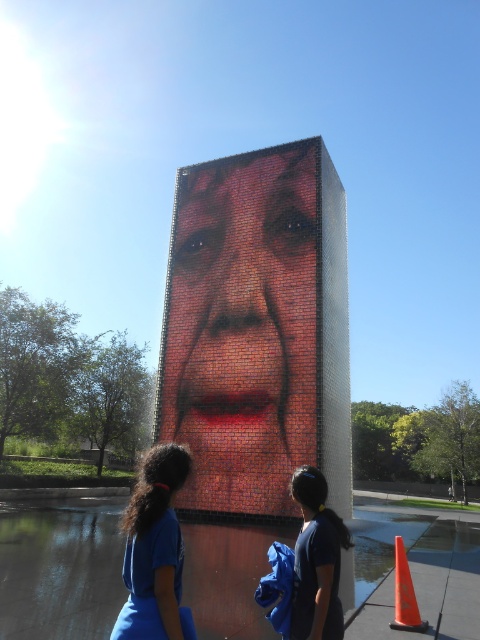
Between blue fabric ponytail at lower left and orange plastic cone at lower right, which one has more height?

orange plastic cone at lower right

Who is lower down, blue fabric ponytail at lower left or orange plastic cone at lower right?

Positioned lower is orange plastic cone at lower right.

Find the location of a particular element. blue fabric ponytail at lower left is located at coordinates (155, 552).

Does point (117, 545) come behind point (180, 557)?

Yes, it is behind point (180, 557).

Which is below, glossy concrete pavement at lower center or blue fabric ponytail at lower left?

glossy concrete pavement at lower center is below.

Find the location of a particular element. This screenshot has height=640, width=480. glossy concrete pavement at lower center is located at coordinates (60, 570).

Who is more forward, (228, 292) or (10, 580)?

Point (10, 580) is more forward.

Between brick mosaic face at center and glossy concrete pavement at lower center, which one appears on the left side from the viewer's perspective?

Positioned to the left is brick mosaic face at center.

This screenshot has height=640, width=480. What do you see at coordinates (241, 326) in the screenshot?
I see `brick mosaic face at center` at bounding box center [241, 326].

You are a GUI agent. You are given a task and a screenshot of the screen. Output one action in this format:
    pyautogui.click(x=<x>, y=<y>)
    Task: Click on the brick mosaic face at center
    The image size is (480, 640).
    Given the screenshot: What is the action you would take?
    pyautogui.click(x=241, y=326)